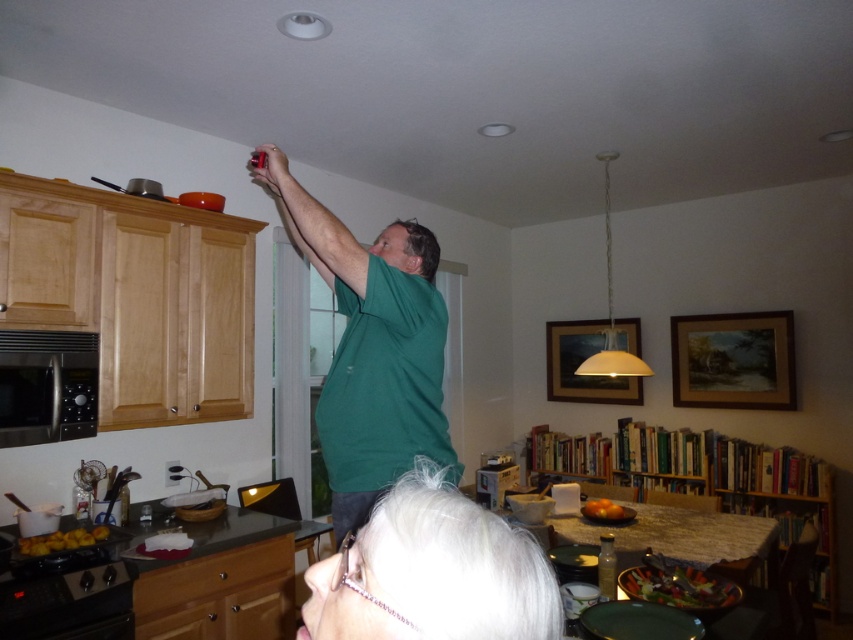
Between green matte shirt at upper center and white hair at lower center, which one has less height?

With less height is white hair at lower center.

What do you see at coordinates (372, 348) in the screenshot?
I see `green matte shirt at upper center` at bounding box center [372, 348].

At what (x,y) coordinates should I click in order to perform the action: click on green matte shirt at upper center. Please return your answer as a coordinate pair (x, y). Looking at the image, I should click on (372, 348).

Is white hair at lower center to the right of stainless steel microwave at left from the viewer's perspective?

Yes, white hair at lower center is to the right of stainless steel microwave at left.

Can you confirm if white hair at lower center is smaller than stainless steel microwave at left?

Actually, white hair at lower center might be larger than stainless steel microwave at left.

Locate an element on the screen. This screenshot has width=853, height=640. white hair at lower center is located at coordinates (432, 572).

You are a GUI agent. You are given a task and a screenshot of the screen. Output one action in this format:
    pyautogui.click(x=<x>, y=<y>)
    Task: Click on the white hair at lower center
    The height and width of the screenshot is (640, 853).
    Given the screenshot: What is the action you would take?
    432,572

Is point (392, 356) more distant than point (27, 360)?

No, it is in front of (27, 360).

Does green matte shirt at upper center have a greater height compared to stainless steel microwave at left?

Yes, green matte shirt at upper center is taller than stainless steel microwave at left.

Where is `green matte shirt at upper center`? The width and height of the screenshot is (853, 640). green matte shirt at upper center is located at coordinates coord(372,348).